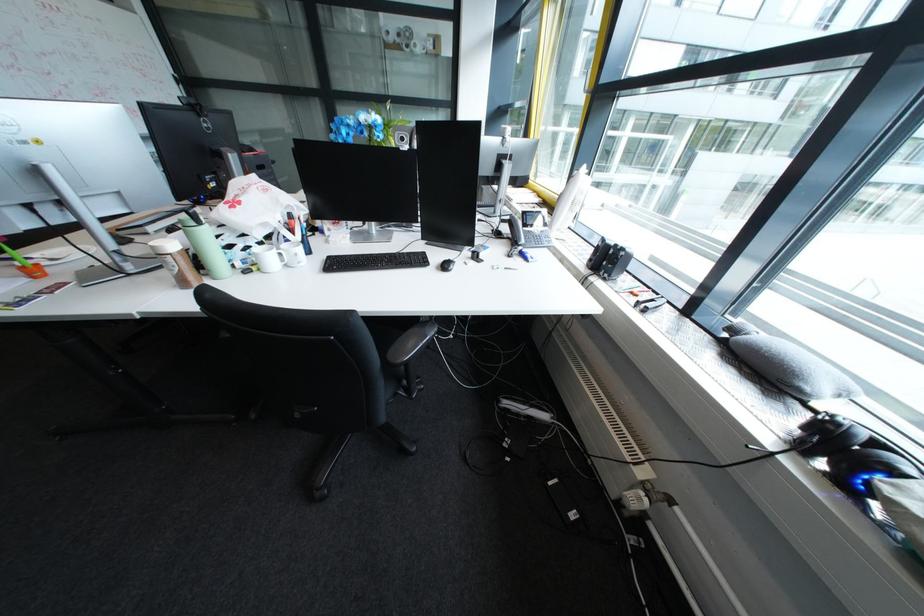
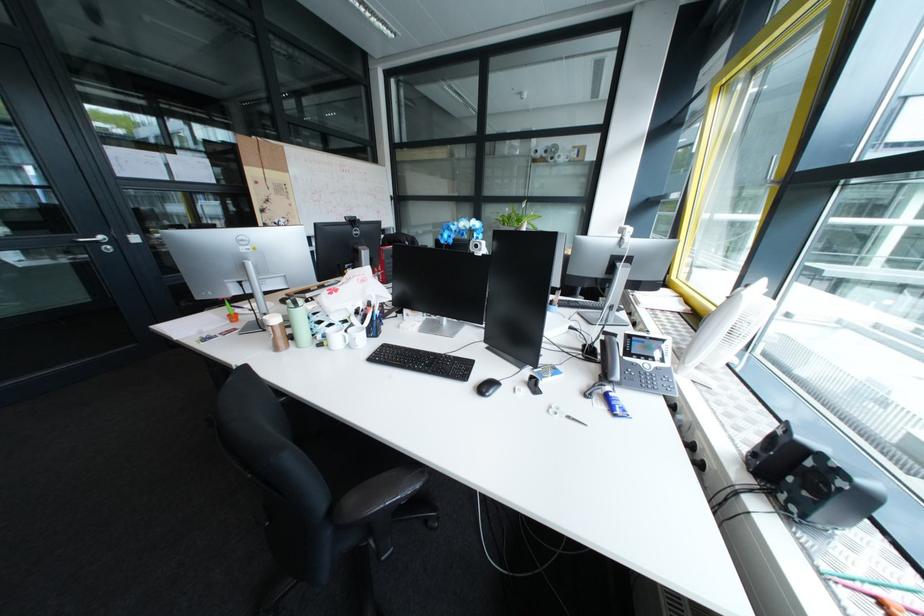
Find the pixel in the second image that matches [433,345] in the first image.

(393, 507)